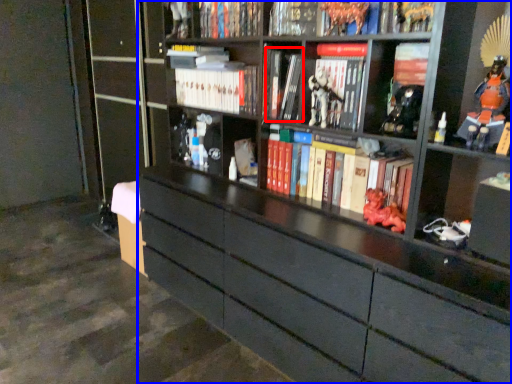
Question: Which object appears farthest to the camera in this image, book (highlighted by a red box) or bookcase (highlighted by a blue box)?

Choices:
 (A) book
 (B) bookcase

Answer: (A)